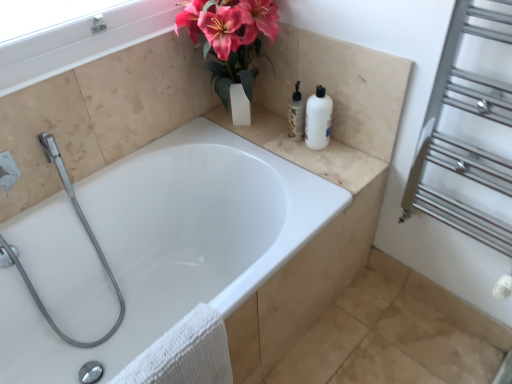
Identify the location of vacant space to the right of white plastic bottle at upper right. The height and width of the screenshot is (384, 512). (349, 153).